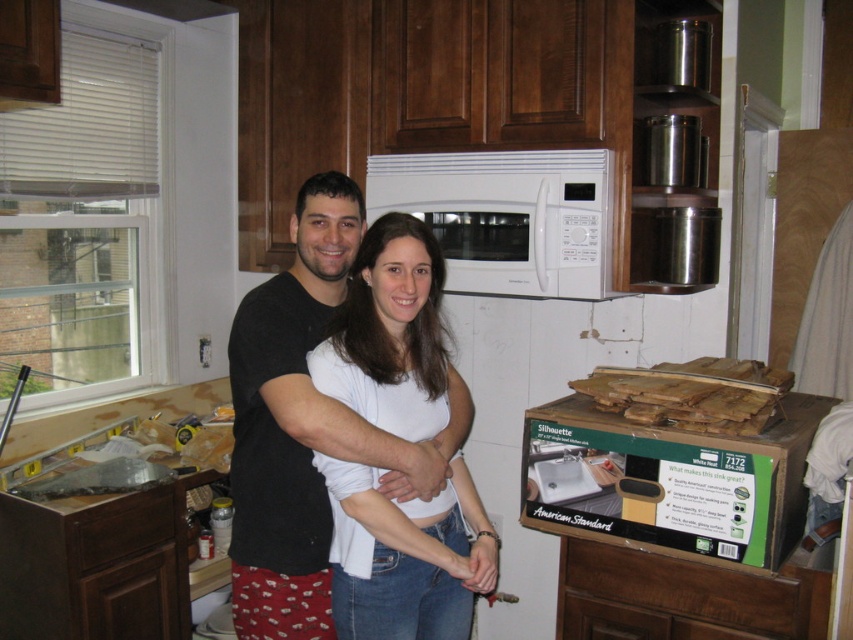
You are a contractor assessing the kitchen layout. You need to install a new shelf that requires 12 inches of vertical space. The shelf must be placed either above the wooden planks at lower center or below the white matte microwave at upper center. Based on their heights, which location would allow enough space for the shelf?

The white matte microwave at upper center has a greater height compared to the wooden planks at lower center. Therefore, installing the shelf below the microwave would provide sufficient vertical space since the microwave is taller, allowing the 12 inches needed for the shelf.

You are a delivery person who just arrived at a house under renovation. You need to place a new package on the floor near the green cardboard box at lower right and wooden planks at lower center. According to the scene, where exactly should you place the package?

The green cardboard box at lower right is positioned on the left side of wooden planks at lower center, so you should place the package to the right of the wooden planks at lower center to keep it near both objects.

You are standing in the kitchen and want to reach the point at coordinates point (x=509, y=225). There is an obstacle at point (x=628, y=397). Can you walk directly to your destination without going around the obstacle?

Point (x=509, y=225) is behind point (x=628, y=397), so you cannot walk directly to the destination without going around the obstacle.